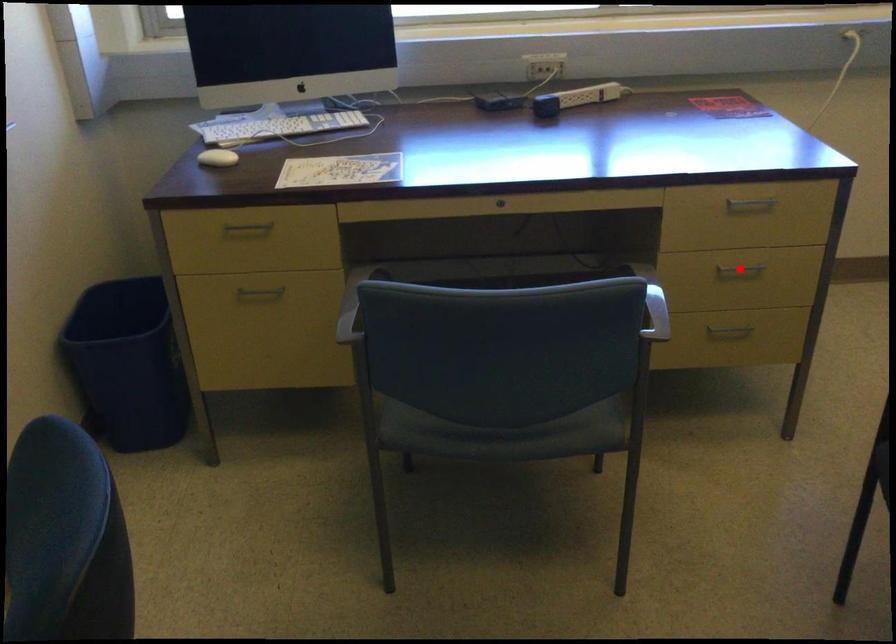
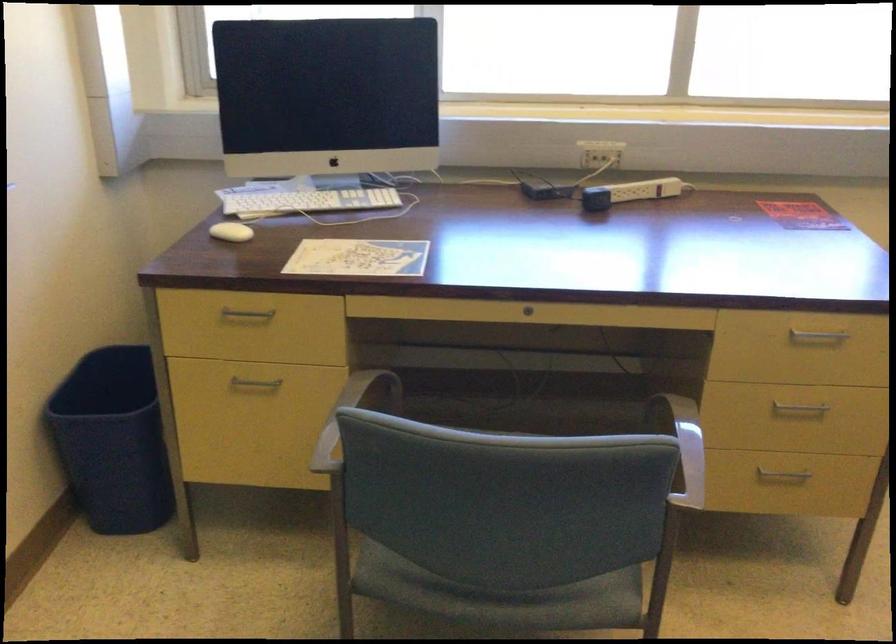
Question: I am providing you with two images of the same scene from different viewpoints. A red point is marked on the first image. Is the red point's position out of view in image 2?

Choices:
 (A) Yes
 (B) No

Answer: (B)